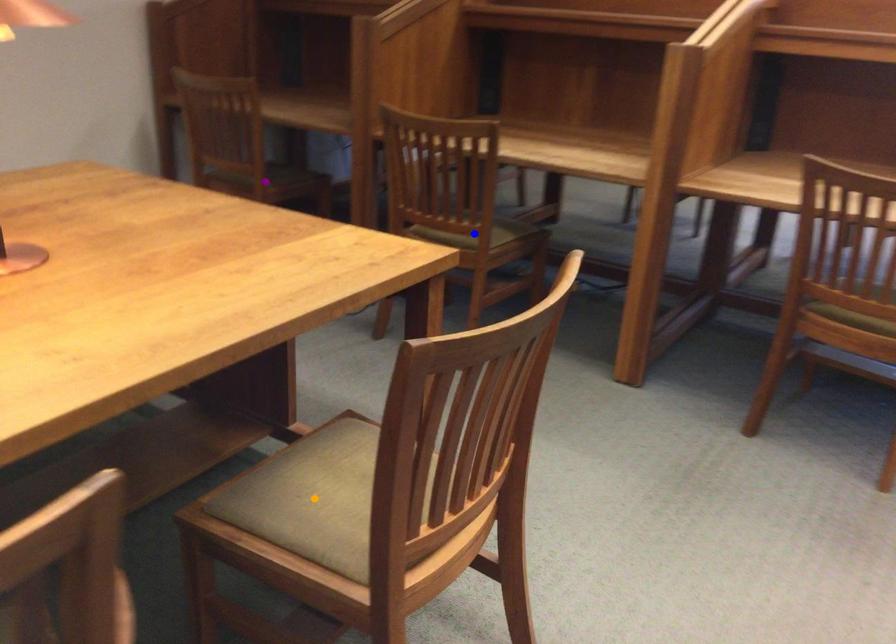
Order these from nearest to farthest:
- purple point
- orange point
- blue point

orange point
blue point
purple point